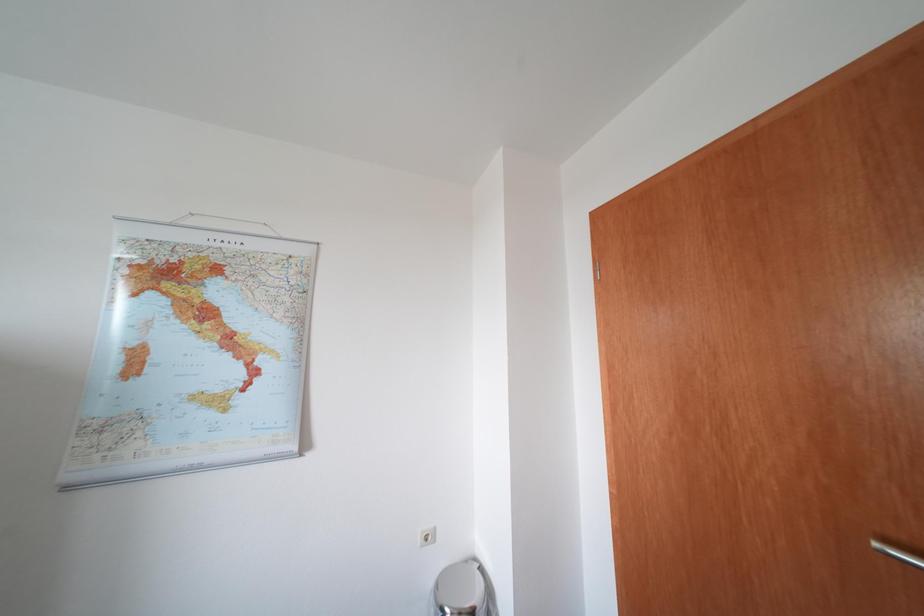
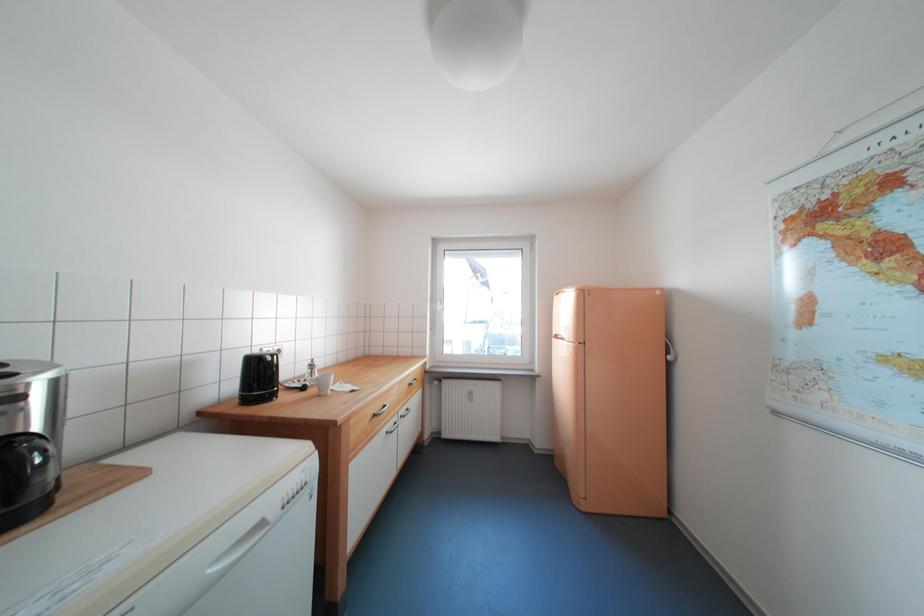
Question: The camera is either moving clockwise (left) or counter-clockwise (right) around the object. The first image is from the beginning of the video and the second image is from the end. Is the camera moving left or right when shooting the video?

Choices:
 (A) Left
 (B) Right

Answer: (B)